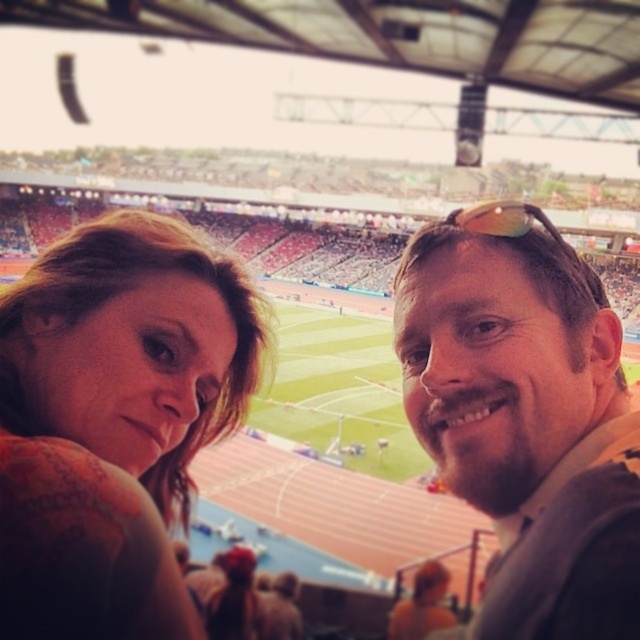
Based on the photo, between matte orange shirt at left and translucent yellow-green sunglasses at center, which one is positioned lower?

matte orange shirt at left

Can you confirm if matte orange shirt at left is positioned to the left of translucent yellow-green sunglasses at center?

Yes, matte orange shirt at left is to the left of translucent yellow-green sunglasses at center.

Where is `matte orange shirt at left`? The height and width of the screenshot is (640, 640). matte orange shirt at left is located at coordinates (115, 419).

Looking at this image, is brown hair at upper right shorter than translucent yellow-green sunglasses at center?

Incorrect, brown hair at upper right's height does not fall short of translucent yellow-green sunglasses at center's.

Where is `brown hair at upper right`? The image size is (640, 640). brown hair at upper right is located at coordinates (525, 420).

Is matte orange shirt at left taller than brown hair at upper right?

Incorrect, matte orange shirt at left's height is not larger of brown hair at upper right's.

Does matte orange shirt at left appear on the right side of brown hair at upper right?

Incorrect, matte orange shirt at left is not on the right side of brown hair at upper right.

The height and width of the screenshot is (640, 640). Identify the location of matte orange shirt at left. (115, 419).